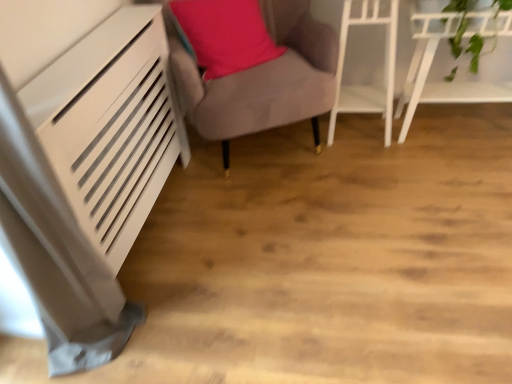
Image resolution: width=512 pixels, height=384 pixels. Find the location of `vacant space to the left of white glossy shelf at upper right, which appears as the first furniture when viewed from the right`. vacant space to the left of white glossy shelf at upper right, which appears as the first furniture when viewed from the right is located at coordinates (385, 165).